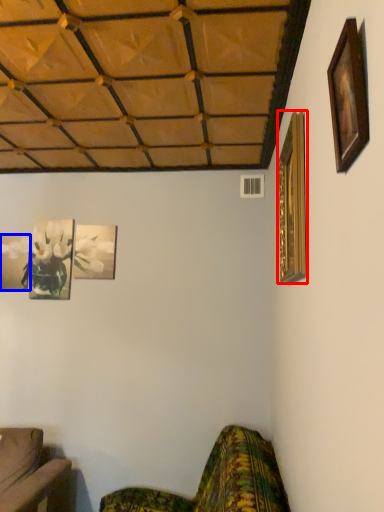
Question: Among these objects, which one is nearest to the camera, picture frame (highlighted by a red box) or picture frame (highlighted by a blue box)?

Choices:
 (A) picture frame
 (B) picture frame

Answer: (A)